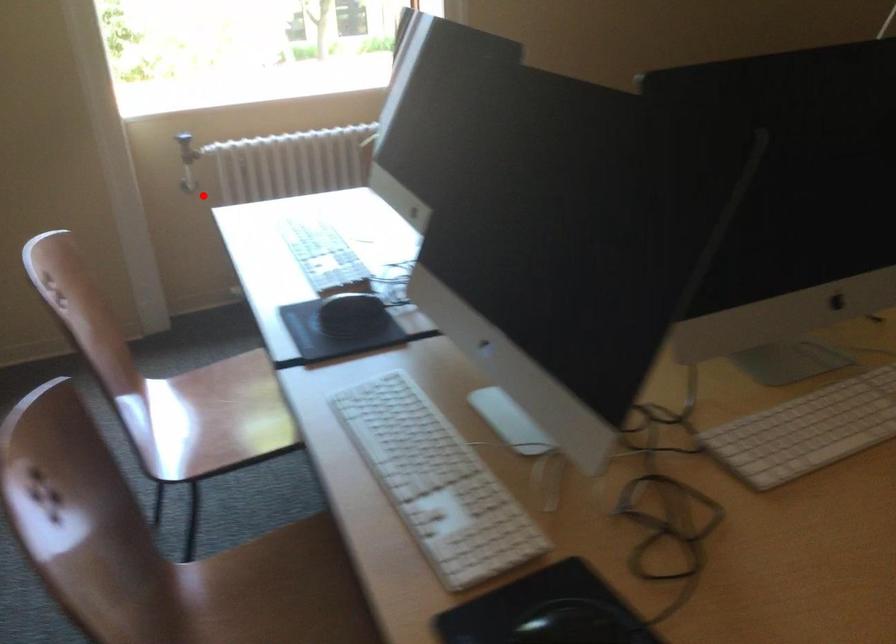
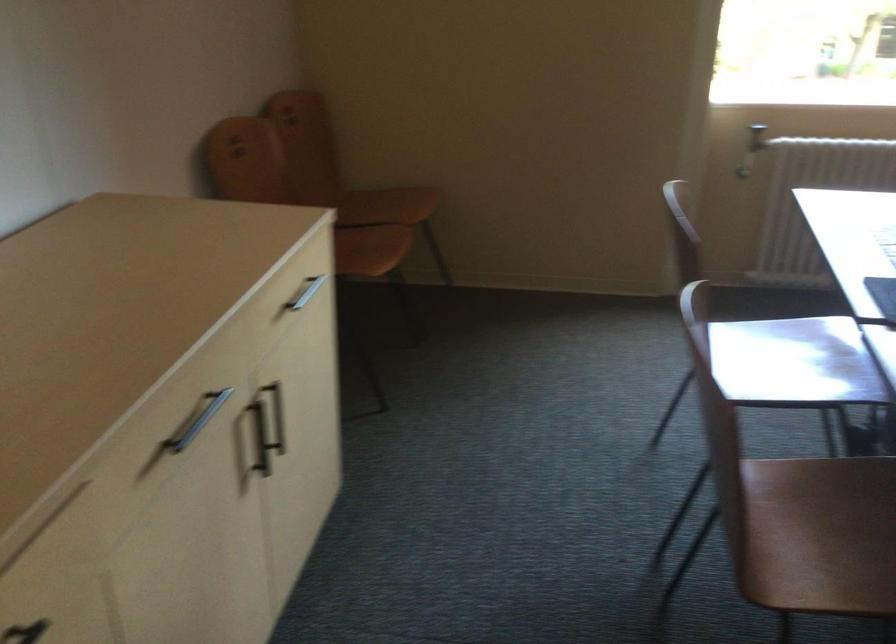
Find the pixel in the second image that matches the highlighted location in the first image.

(743, 172)